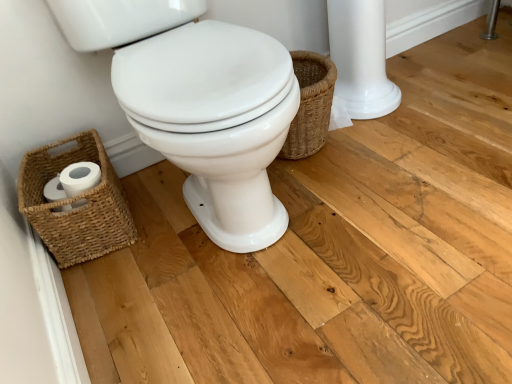
Locate an element on the screen. vacant space to the right of woven brown basket at lower left is located at coordinates (166, 218).